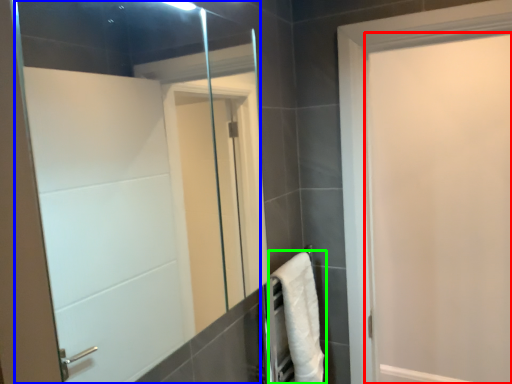
Question: Which is farther away from door (highlighted by a red box)? mirror (highlighted by a blue box) or bath towel (highlighted by a green box)?

Choices:
 (A) mirror
 (B) bath towel

Answer: (A)